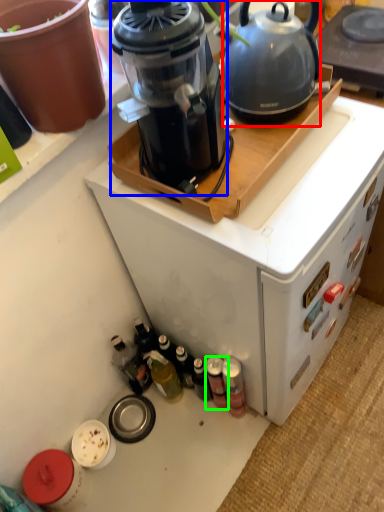
Question: Estimate the real-world distances between objects in this image. Which object is closer to kettle (highlighted by a red box), blender (highlighted by a blue box) or bottle (highlighted by a green box)?

Choices:
 (A) blender
 (B) bottle

Answer: (A)